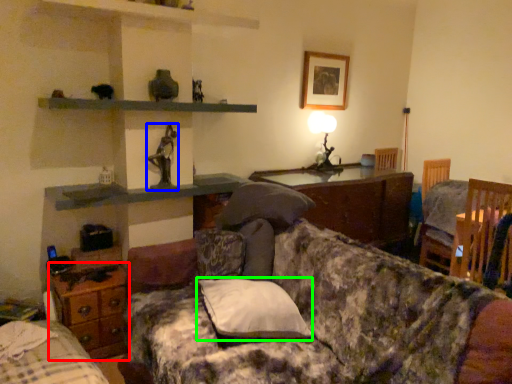
Question: Based on their relative distances, which object is nearer to table (highlighted by a red box)? Choose from person (highlighted by a blue box) and pillow (highlighted by a green box).

Choices:
 (A) person
 (B) pillow

Answer: (A)